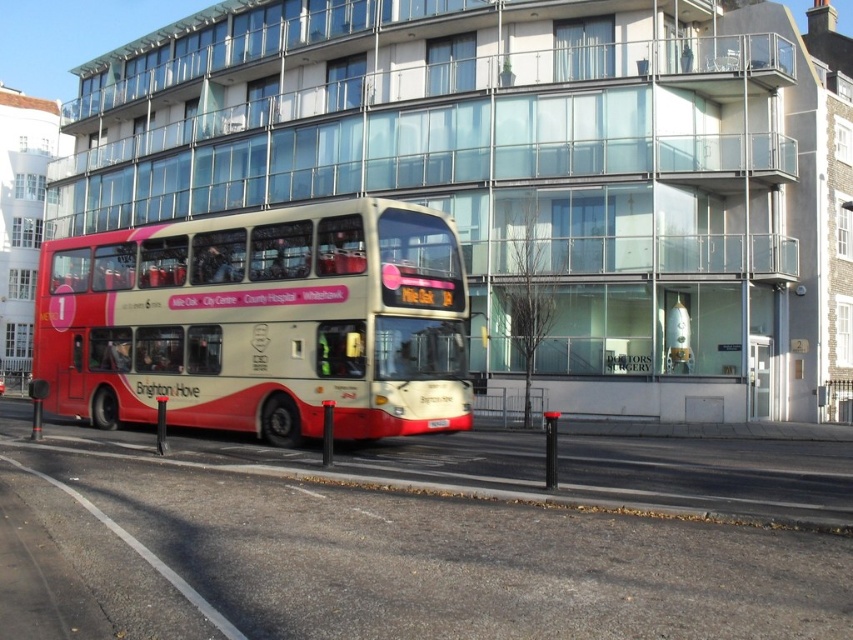
You are standing on the sidewalk and want to take a photo of the red matte bus at center. If your camera can focus on objects up to 40 feet away, will you need to move closer or farther away to get a clear shot?

The red matte bus at center is 42.29 feet from the viewer. Since the camera can focus up to 40 feet, you need to move closer to ensure the bus is within the camera range.

You are a delivery person trying to deliver a package to the red matte bus at center. You see the white plastic license plate at center. Which object is nearer to you?

The red matte bus at center is closer to the viewer than the white plastic license plate at center.